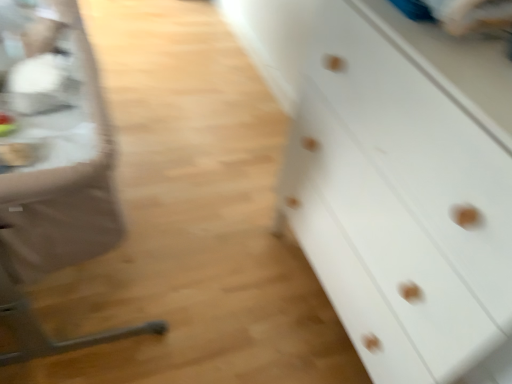
What are the coordinates of `free point behind metallic silver feeding chair at left` in the screenshot? It's located at (183, 134).